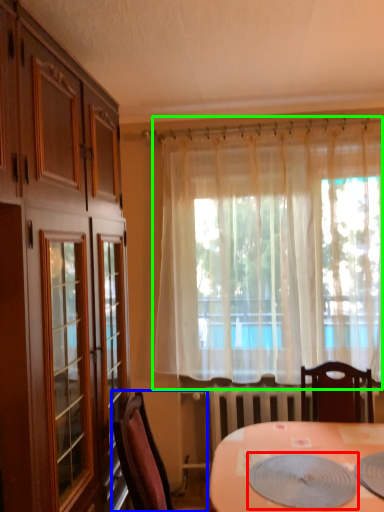
Question: Which is nearer to the platter (highlighted by a red box)? chair (highlighted by a blue box) or curtain (highlighted by a green box).

Choices:
 (A) chair
 (B) curtain

Answer: (A)